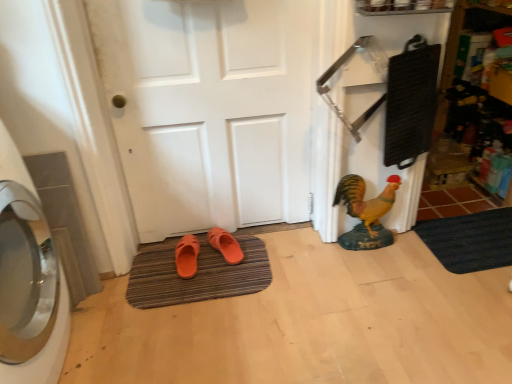
Where is `vacant area that is in front of black rubber bath mat at lower right, which is counted as the 1th bath mat, starting from the right`? vacant area that is in front of black rubber bath mat at lower right, which is counted as the 1th bath mat, starting from the right is located at coordinates (477, 304).